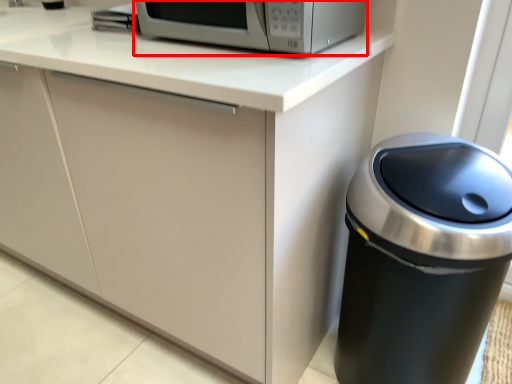
Question: From the image, what is the correct spatial relationship of home appliance (annotated by the red box) in relation to waste container?

Choices:
 (A) left
 (B) right

Answer: (A)